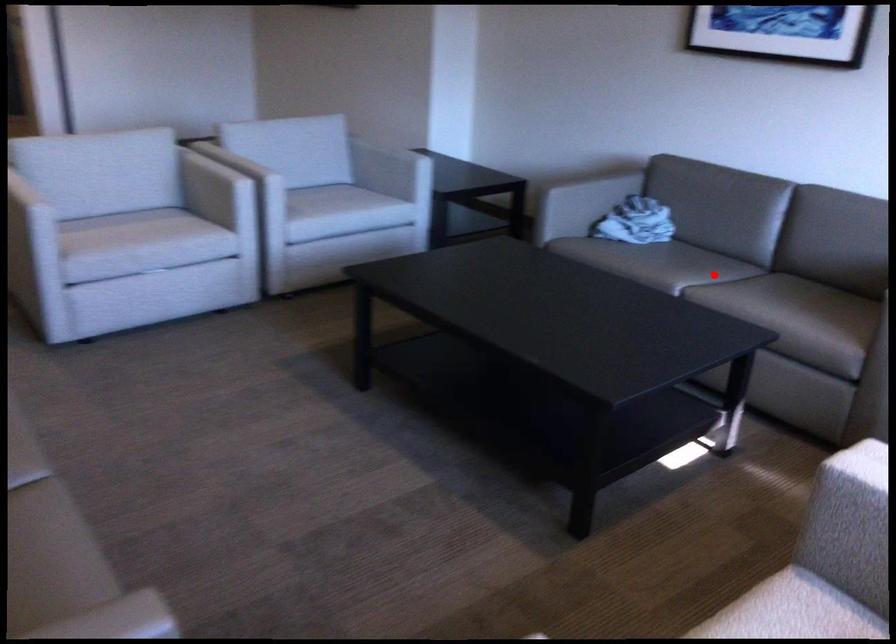
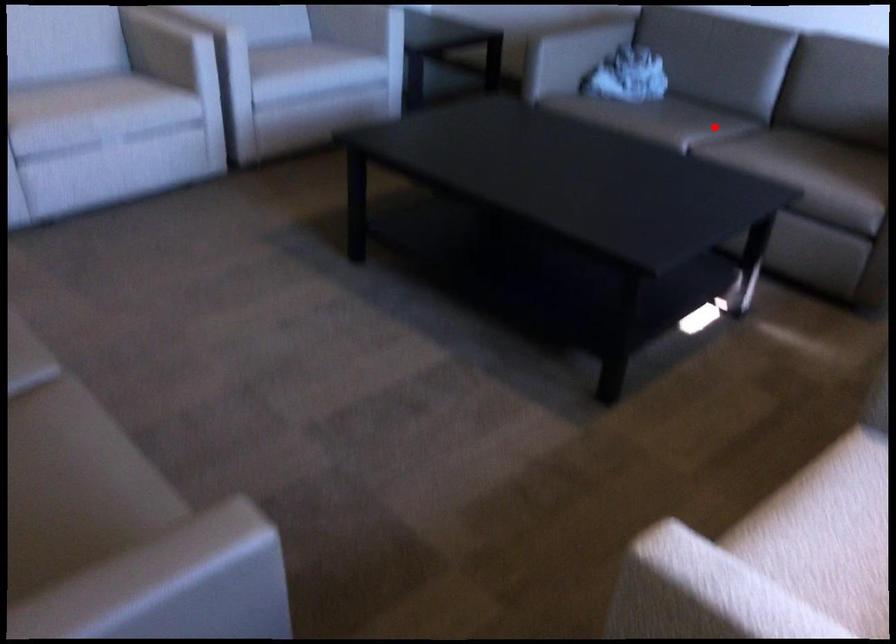
I am providing you with two images of the same scene from different viewpoints. A red point is marked on the first image and another point is marked on the second image. Does the point marked in image1 correspond to the same location as the one in image2?

Yes